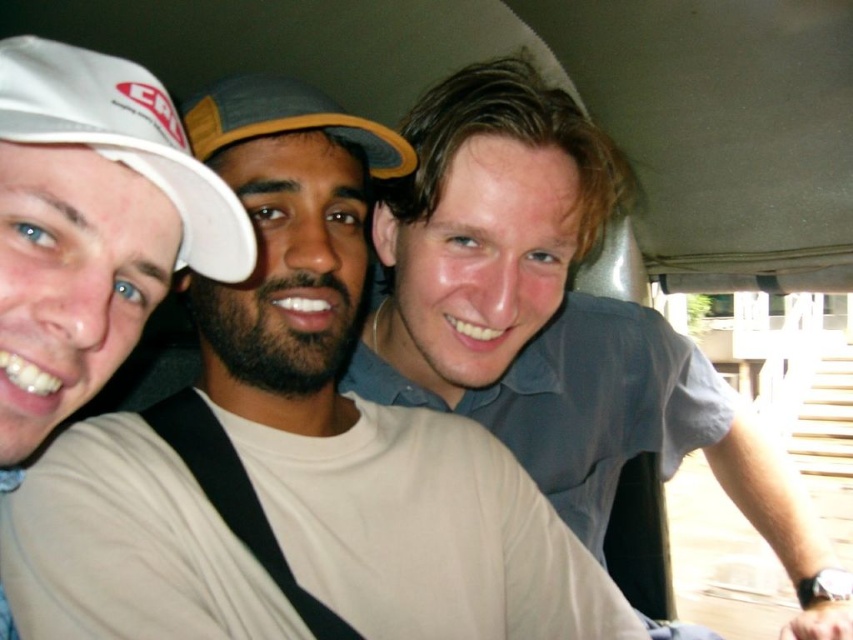
You are a passenger in the vehicle and want to look out the window. You notice two points on the window glass. The first point is at coordinate point (x=65, y=305) and the second is at point (x=270, y=122). Which point is closer to the front of the vehicle?

Point (x=65, y=305) is in front of point (x=270, y=122), so the first point is closer to the front of the vehicle.

You are a tailor who needs to determine which cap requires more fabric for a similar design. Based on the image, which of the two caps, the white fabric cap at left or the gray fabric baseball cap at center, would need more fabric?

The gray fabric baseball cap at center requires more fabric because it has a greater width than the white fabric cap at left.